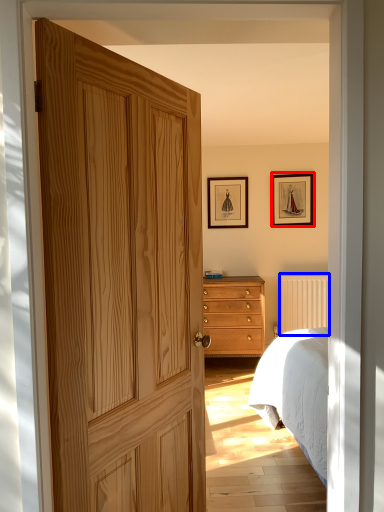
Question: Which object appears farthest to the camera in this image, picture frame (highlighted by a red box) or radiator (highlighted by a blue box)?

Choices:
 (A) picture frame
 (B) radiator

Answer: (A)